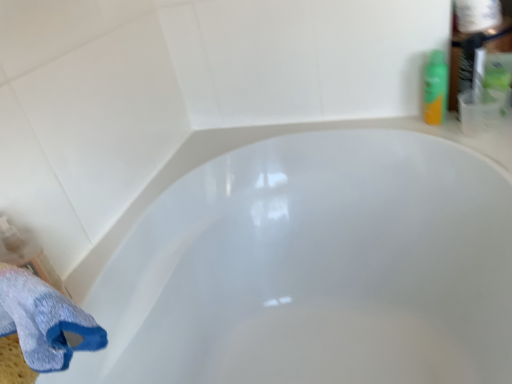
Question: From a real-world perspective, does green plastic spray can at upper right sit lower than white paper towel at upper right?

Choices:
 (A) yes
 (B) no

Answer: (A)

Question: Is green plastic spray can at upper right further to camera compared to white paper towel at upper right?

Choices:
 (A) no
 (B) yes

Answer: (B)

Question: From the image's perspective, does green plastic spray can at upper right appear higher than white paper towel at upper right?

Choices:
 (A) yes
 (B) no

Answer: (B)

Question: Can white paper towel at upper right be found inside green plastic spray can at upper right?

Choices:
 (A) yes
 (B) no

Answer: (B)

Question: Can you confirm if green plastic spray can at upper right is smaller than white paper towel at upper right?

Choices:
 (A) yes
 (B) no

Answer: (A)

Question: Does green plastic spray can at upper right appear on the right side of white paper towel at upper right?

Choices:
 (A) no
 (B) yes

Answer: (A)

Question: Could you tell me if blue textured bath towel at lower left is facing white glossy bathtub at center?

Choices:
 (A) yes
 (B) no

Answer: (B)

Question: From the image's perspective, is blue textured bath towel at lower left located beneath white glossy bathtub at center?

Choices:
 (A) no
 (B) yes

Answer: (A)

Question: Is blue textured bath towel at lower left bigger than white glossy bathtub at center?

Choices:
 (A) yes
 (B) no

Answer: (B)

Question: Would you say blue textured bath towel at lower left is a long distance from white glossy bathtub at center?

Choices:
 (A) no
 (B) yes

Answer: (A)

Question: From a real-world perspective, does blue textured bath towel at lower left sit lower than white glossy bathtub at center?

Choices:
 (A) yes
 (B) no

Answer: (B)

Question: Does blue textured bath towel at lower left have a smaller size compared to white glossy bathtub at center?

Choices:
 (A) yes
 (B) no

Answer: (A)

Question: Can you confirm if white paper towel at upper right is positioned to the right of white glossy bathtub at center?

Choices:
 (A) no
 (B) yes

Answer: (B)